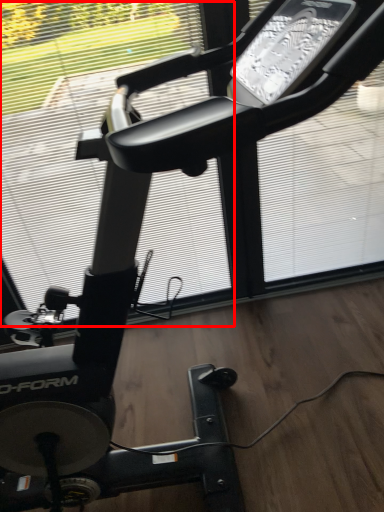
Question: In this image, where is window screen (annotated by the red box) located relative to window screen?

Choices:
 (A) left
 (B) right

Answer: (A)